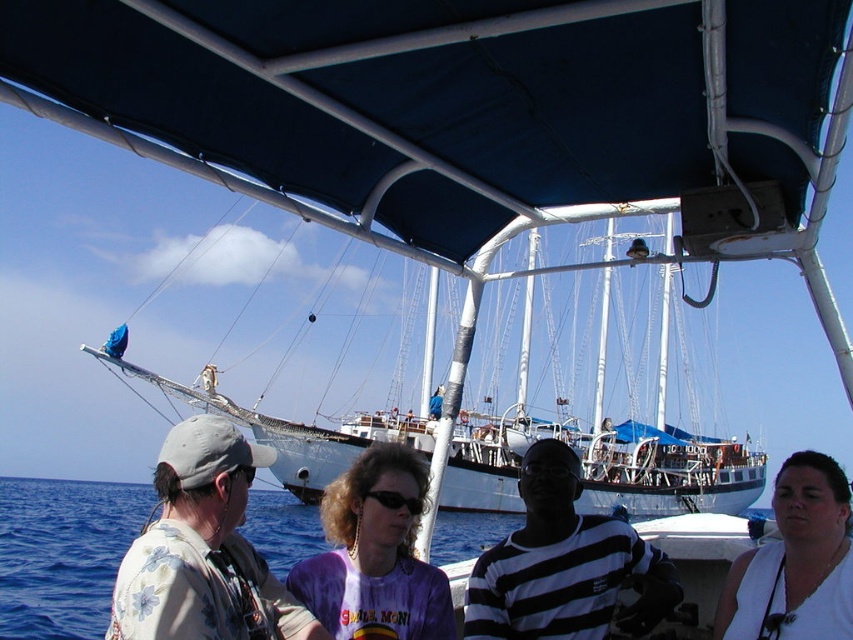
Question: From the image, what is the correct spatial relationship of blue fabric canopy at upper center in relation to purple tie-dye shirt at center?

Choices:
 (A) left
 (B) right

Answer: (B)

Question: Does white wooden sailboat at center have a smaller size compared to floral shirt at left?

Choices:
 (A) yes
 (B) no

Answer: (B)

Question: Is blue fabric canopy at upper center closer to camera compared to white wooden sailboat at center?

Choices:
 (A) no
 (B) yes

Answer: (B)

Question: Which point is farther to the camera?

Choices:
 (A) (0, 477)
 (B) (814, 589)
 (C) (451, 100)
 (D) (363, 621)

Answer: (A)

Question: Which point is closer to the camera?

Choices:
 (A) (701, 131)
 (B) (560, 557)

Answer: (A)

Question: Which of the following is the closest to the observer?

Choices:
 (A) purple tie-dye shirt at center
 (B) blue fabric canopy at upper center
 (C) white wooden sailboat at center
 (D) black striped shirt at center

Answer: (B)